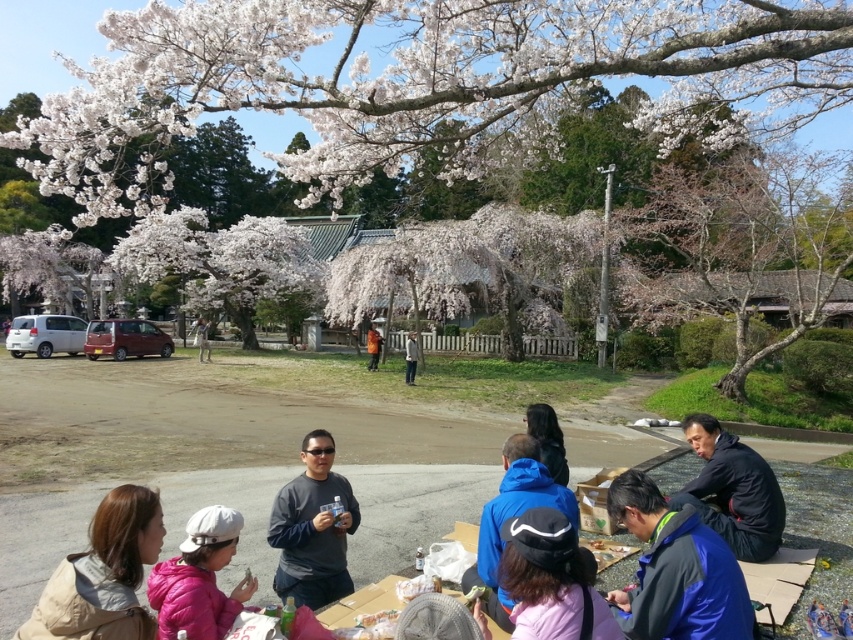
Between dark blue fabric cap at center and khaki fabric jacket at center, which one is positioned higher?

dark blue fabric cap at center is higher up.

Looking at this image, does dark blue fabric cap at center come in front of khaki fabric jacket at center?

Yes, dark blue fabric cap at center is in front of khaki fabric jacket at center.

Where is `dark blue fabric cap at center`? The image size is (853, 640). dark blue fabric cap at center is located at coordinates (550, 580).

Is beige fabric jacket at lower left in front of khaki fabric jacket at center?

Yes, it is in front of khaki fabric jacket at center.

Does beige fabric jacket at lower left have a larger size compared to khaki fabric jacket at center?

Actually, beige fabric jacket at lower left might be smaller than khaki fabric jacket at center.

What do you see at coordinates (103, 573) in the screenshot?
I see `beige fabric jacket at lower left` at bounding box center [103, 573].

The width and height of the screenshot is (853, 640). Find the location of `beige fabric jacket at lower left`. beige fabric jacket at lower left is located at coordinates (103, 573).

Which is above, dark blue fabric cap at center or black fabric jacket at lower right?

dark blue fabric cap at center is above.

Does dark blue fabric cap at center appear on the left side of black fabric jacket at lower right?

Yes, dark blue fabric cap at center is to the left of black fabric jacket at lower right.

In order to click on dark blue fabric cap at center in this screenshot , I will do `click(550, 580)`.

You are a GUI agent. You are given a task and a screenshot of the screen. Output one action in this format:
    pyautogui.click(x=<x>, y=<y>)
    Task: Click on the dark blue fabric cap at center
    
    Given the screenshot: What is the action you would take?
    pyautogui.click(x=550, y=580)